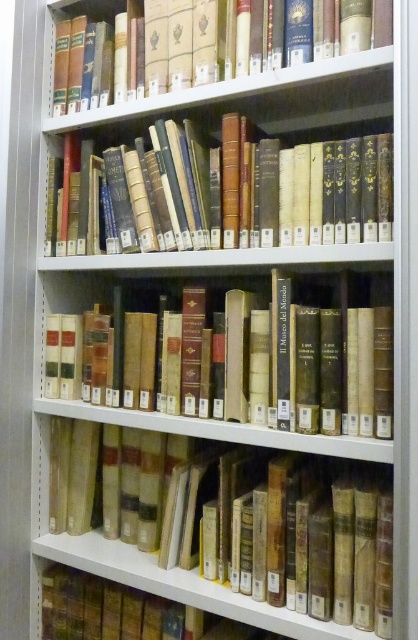
You are a librarian organizing books in the library. You need to place a new book on the shelf. There is a point marked at coordinates (213, 534). What is located at this point?

At point (213, 534) lies a yellowish paper book at center.

You are a librarian organizing books in the library. You need to place a new book exactly at the center of the shelf. The shelf has a coordinate system where the bottom left corner is the origin point. The yellowish paper book at center is currently occupying a spot. Where should you place the new book to ensure it is centered?

The yellowish paper book at center is located at coordinates point (213, 534). To place the new book exactly at the center of the shelf, you should position it at the midpoint of the shelf, which is typically at coordinates (209, 320). However, since the current book is at (213, 534), you might need to adjust based on the shelf dimensions. If the shelf spans from 0 to 1 in both axes, the true center would be at (209, 320), so move the new book there, displacing the yellowish paper book at center if needed.